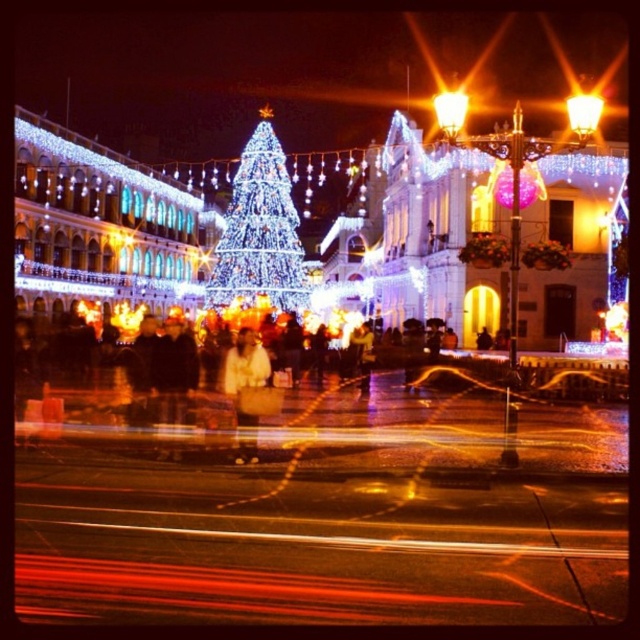
Question: Is illuminated glass christmas tree at center thinner than matte gold streetlight at upper right?

Choices:
 (A) no
 (B) yes

Answer: (B)

Question: Which of the following is the closest to the observer?

Choices:
 (A) (442, 118)
 (B) (250, 320)

Answer: (A)

Question: Which of the following is the farthest from the observer?

Choices:
 (A) white matte coat at center
 (B) illuminated glass christmas tree at center

Answer: (B)

Question: Estimate the real-world distances between objects in this image. Which object is closer to the metallic streetlight at center?

Choices:
 (A) illuminated glass christmas tree at center
 (B) white matte coat at center

Answer: (B)

Question: Can you confirm if metallic streetlight at center is smaller than matte gold streetlight at upper right?

Choices:
 (A) no
 (B) yes

Answer: (B)

Question: Does illuminated glass christmas tree at center have a larger size compared to matte gold streetlight at upper right?

Choices:
 (A) no
 (B) yes

Answer: (A)